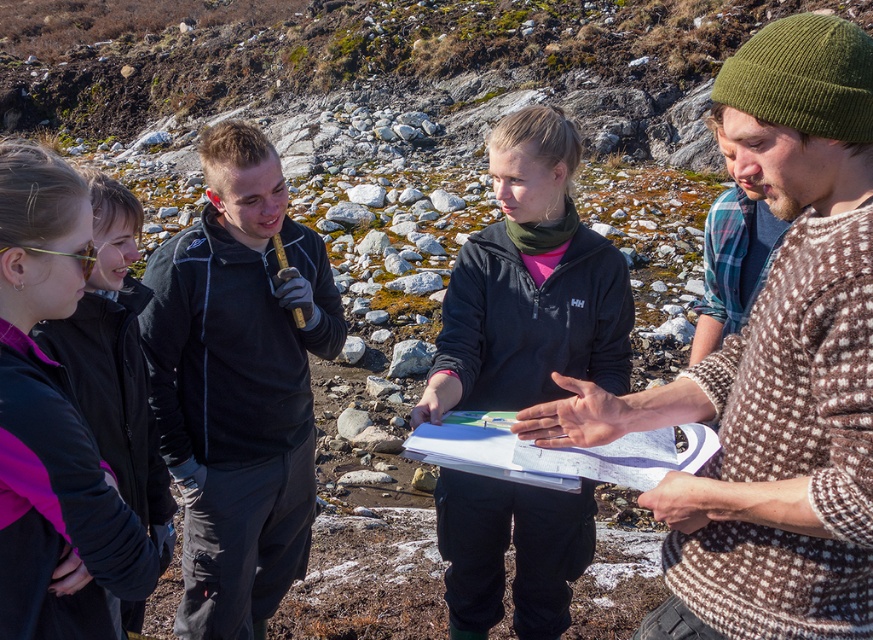
Can you confirm if black fleece jacket at center is positioned to the left of dark blue fleece jacket at center?

Yes, black fleece jacket at center is to the left of dark blue fleece jacket at center.

Does black fleece jacket at center appear on the right side of dark blue fleece jacket at center?

No, black fleece jacket at center is not to the right of dark blue fleece jacket at center.

Identify the location of black fleece jacket at center. This screenshot has width=873, height=640. (238, 385).

You are a GUI agent. You are given a task and a screenshot of the screen. Output one action in this format:
    pyautogui.click(x=<x>, y=<y>)
    Task: Click on the black fleece jacket at center
    
    Given the screenshot: What is the action you would take?
    pyautogui.click(x=238, y=385)

Can you confirm if brown knitted hat at upper right is positioned to the right of black fleece jacket at center?

Correct, you'll find brown knitted hat at upper right to the right of black fleece jacket at center.

Is brown knitted hat at upper right shorter than black fleece jacket at center?

Correct, brown knitted hat at upper right is not as tall as black fleece jacket at center.

Where is `brown knitted hat at upper right`? The height and width of the screenshot is (640, 873). brown knitted hat at upper right is located at coordinates [773, 369].

How much distance is there between brown knitted hat at upper right and gray rough rock at center?

They are 8.27 meters apart.

Can you confirm if brown knitted hat at upper right is positioned to the left of gray rough rock at center?

Incorrect, brown knitted hat at upper right is not on the left side of gray rough rock at center.

Who is more forward, (785, 68) or (390, 364)?

Point (785, 68) is more forward.

Image resolution: width=873 pixels, height=640 pixels. I want to click on brown knitted hat at upper right, so click(x=773, y=369).